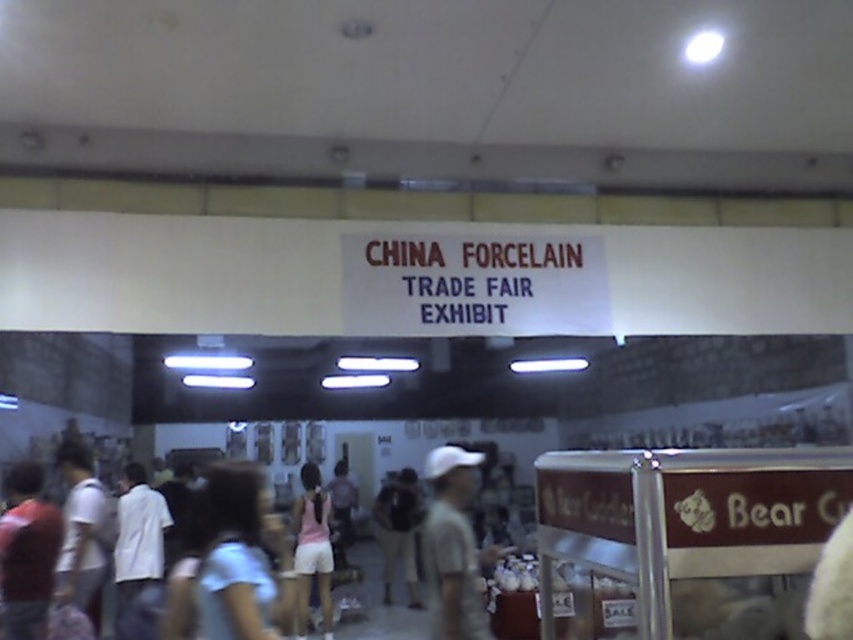
Which is more to the left, light blue fabric at center or gray matte shirt at center?

Positioned to the left is light blue fabric at center.

The width and height of the screenshot is (853, 640). Find the location of `light blue fabric at center`. light blue fabric at center is located at coordinates (241, 557).

I want to click on light blue fabric at center, so click(x=241, y=557).

Does matte red shirt at left have a greater height compared to pink fabric shorts at center?

Incorrect, matte red shirt at left's height is not larger of pink fabric shorts at center's.

Between matte red shirt at left and pink fabric shorts at center, which one has less height?

With less height is matte red shirt at left.

Describe the element at coordinates (26, 552) in the screenshot. This screenshot has width=853, height=640. I see `matte red shirt at left` at that location.

Locate an element on the screen. The width and height of the screenshot is (853, 640). matte red shirt at left is located at coordinates (26, 552).

Is white cotton shirt at center taller than pink fabric shorts at center?

In fact, white cotton shirt at center may be shorter than pink fabric shorts at center.

Measure the distance between point (142,493) and camera.

Point (142,493) is 20.37 feet away from camera.

Who is more distant from viewer, (131, 525) or (310, 561)?

The point (310, 561) is more distant.

At what (x,y) coordinates should I click in order to perform the action: click on white cotton shirt at center. Please return your answer as a coordinate pair (x, y). Looking at the image, I should click on (138, 536).